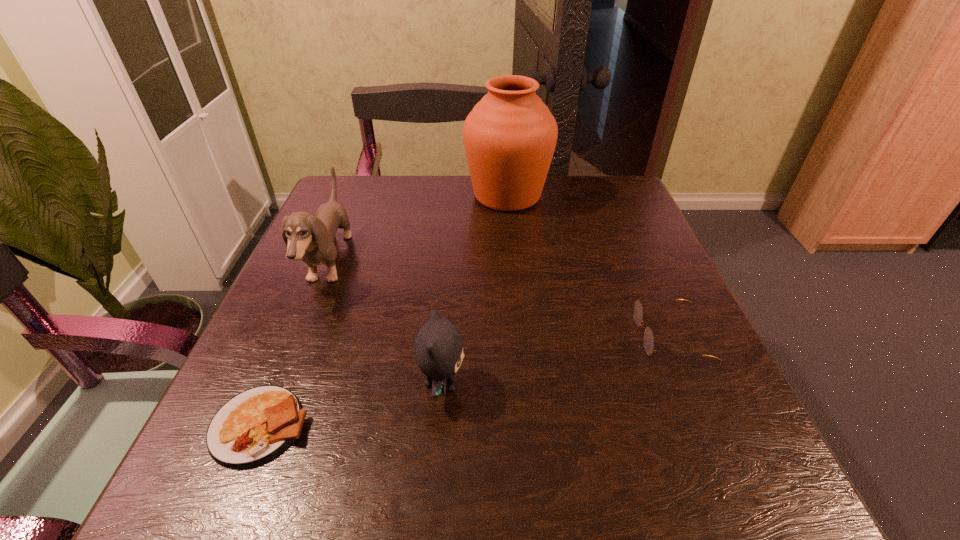
You are a GUI agent. You are given a task and a screenshot of the screen. Output one action in this format:
    pyautogui.click(x=<x>, y=<y>)
    Task: Click on the free spot that satisfies the following two spatial constraints: 1. on the front-facing side of the kitten; 2. on the front side of the omelet
    Image resolution: width=960 pixels, height=540 pixels.
    Given the screenshot: What is the action you would take?
    pyautogui.click(x=439, y=426)

This screenshot has width=960, height=540. I want to click on vacant space that satisfies the following two spatial constraints: 1. on the temples of the spectacles; 2. on the front side of the shortest object, so pos(708,426).